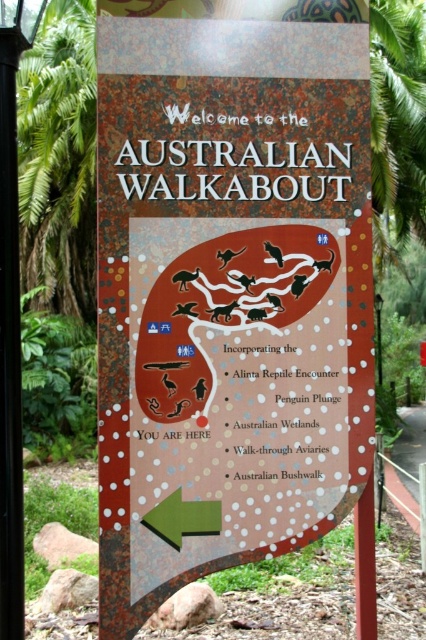
You are a delivery person carrying a package that is 3 feet wide. You need to pass between the rustic wooden sign at center and the black metal pole at left. Can your package fit through the space between them?

The distance between the rustic wooden sign at center and the black metal pole at left is 27.45 inches. Since 3 feet equals 36 inches, the package is wider than the available space. Therefore, the package cannot fit through the space between them.

You are standing in front of the rustic wooden sign at center and want to touch the black metal pole at left. Which direction should you move to reach it?

You should move towards the left because the black metal pole at left is positioned to the left of the rustic wooden sign at center.

You are standing at the point marked at (100, 618) on the signboard. There is another point 8.20 feet away from you. Can you estimate how far that point is from the bottom edge of the signboard?

The point marked at (100, 618) is 8.20 feet away from the other point. However, without knowing the exact position of the other point relative to the bottom edge, we cannot determine its distance from the bottom edge of the signboard.